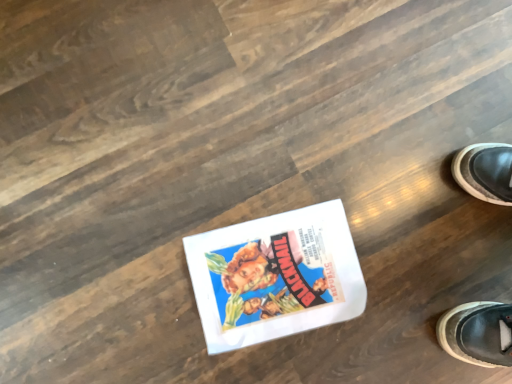
This screenshot has height=384, width=512. Identify the location of free location to the right of matte paper book at center. (397, 311).